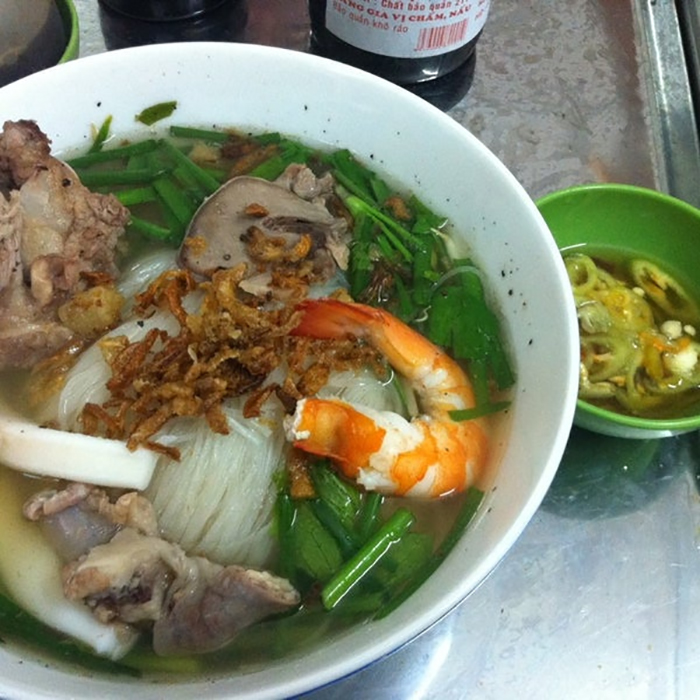
You are a GUI agent. You are given a task and a screenshot of the screen. Output one action in this format:
    pyautogui.click(x=<x>, y=<y>)
    Task: Click on the green bowl
    
    Given the screenshot: What is the action you would take?
    pyautogui.click(x=605, y=220)